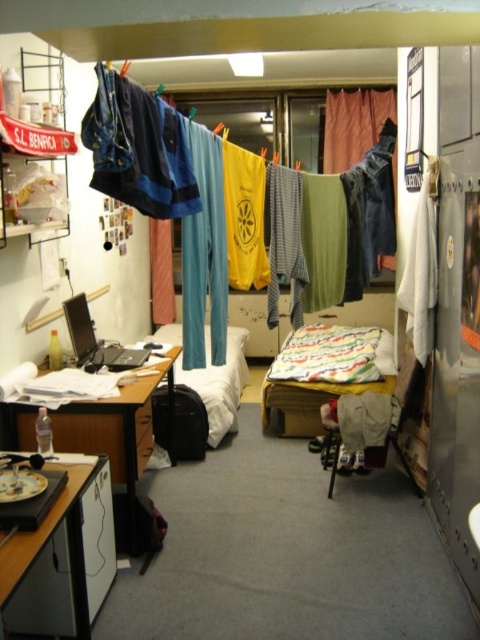
Is wooden desk at left bigger than white fabric bed at center?

Actually, wooden desk at left might be smaller than white fabric bed at center.

Between point (171, 397) and point (208, 336), which one is positioned in front?

Point (171, 397)

The width and height of the screenshot is (480, 640). In order to click on wooden desk at left in this screenshot , I will do `click(119, 429)`.

At what (x,y) coordinates should I click in order to perform the action: click on wooden desk at left. Please return your answer as a coordinate pair (x, y). Image resolution: width=480 pixels, height=640 pixels. Looking at the image, I should click on (119, 429).

Is white glossy table at lower left positioned behind yellow fabric clothesline at center?

No.

Is white glossy table at lower left to the left of yellow fabric clothesline at center from the viewer's perspective?

Indeed, white glossy table at lower left is positioned on the left side of yellow fabric clothesline at center.

Where is `white glossy table at lower left`? The width and height of the screenshot is (480, 640). white glossy table at lower left is located at coordinates (63, 560).

Which is below, yellow fabric clothesline at center or wooden desk at left?

wooden desk at left

Does yellow fabric clothesline at center have a greater height compared to wooden desk at left?

In fact, yellow fabric clothesline at center may be shorter than wooden desk at left.

Does point (136, 173) come behind point (117, 444)?

No, it is not.

The width and height of the screenshot is (480, 640). In order to click on yellow fabric clothesline at center in this screenshot , I will do `click(128, 152)`.